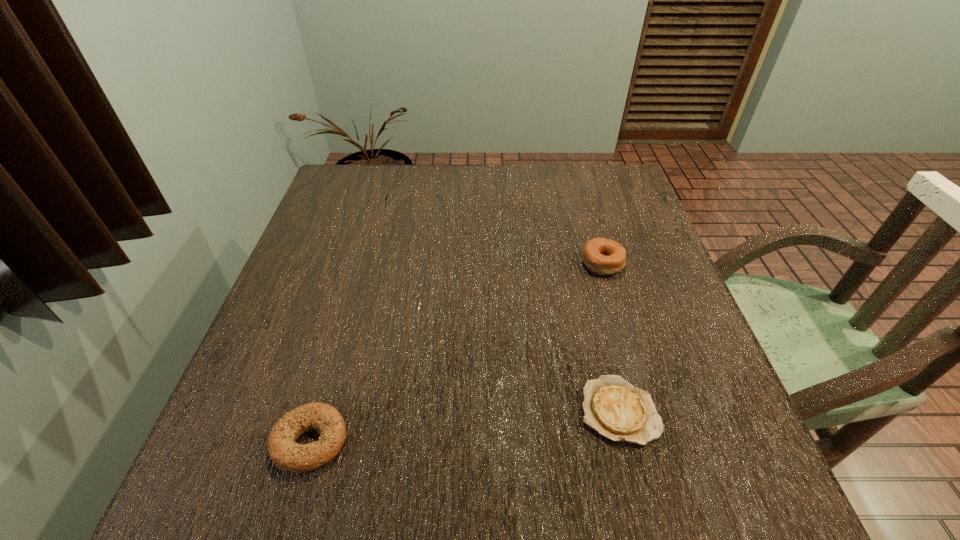
Locate an element on the screen. unoccupied area between the left bagel and the right bagel is located at coordinates (456, 352).

Identify the location of free point between the taller bagel and the farthest object. The width and height of the screenshot is (960, 540). (492, 235).

At what (x,y) coordinates should I click in order to perform the action: click on free spot between the left bagel and the farthest object. Please return your answer as a coordinate pair (x, y). The width and height of the screenshot is (960, 540). Looking at the image, I should click on (346, 324).

Find the location of a particular element. The width and height of the screenshot is (960, 540). free space between the sunglasses and the quiche is located at coordinates (500, 309).

I want to click on free area in between the farthest object and the second shortest object, so click(346, 324).

Locate an element on the screen. This screenshot has height=540, width=960. object that is the second closest to the farther bagel is located at coordinates 385,197.

Identify which object is the closest to the farthest object. Please provide its 2D coordinates. Your answer should be formatted as a tuple, i.e. [(x, y)], where the tuple contains the x and y coordinates of a point satisfying the conditions above.

[(601, 256)]

Identify the location of free space that satisfies the following two spatial constraints: 1. in front of the lenses of the taller bagel; 2. on the right side of the sunglasses. (365, 263).

Where is `vacant space that satisfies the following two spatial constraints: 1. in front of the lenses of the shortest object; 2. on the left side of the farthest object`? Image resolution: width=960 pixels, height=540 pixels. vacant space that satisfies the following two spatial constraints: 1. in front of the lenses of the shortest object; 2. on the left side of the farthest object is located at coordinates (324, 411).

What are the coordinates of `free space that satisfies the following two spatial constraints: 1. in front of the lenses of the right bagel; 2. on the left side of the sunglasses` in the screenshot? It's located at (365, 263).